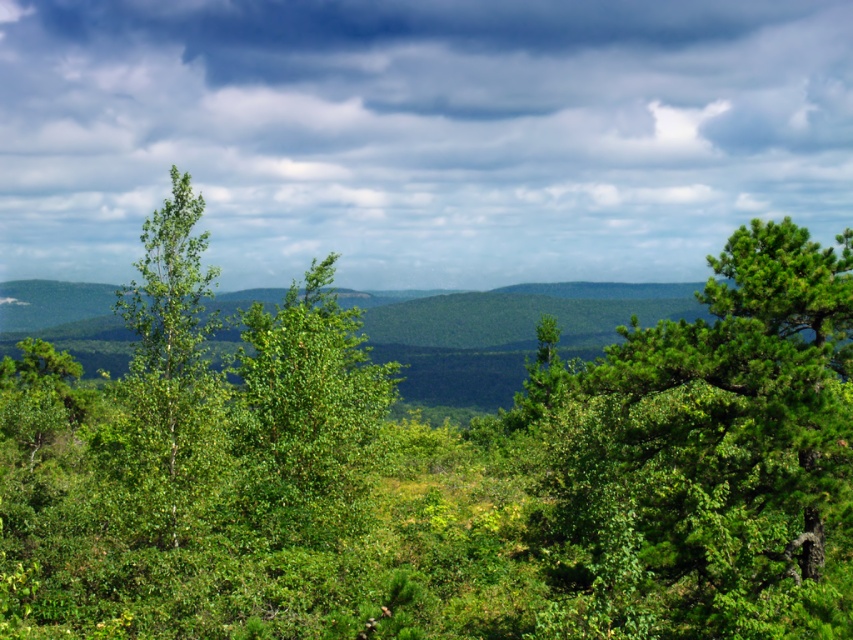
You are standing in the middle of the lush landscape and want to walk towards the green matte tree at right and the green matte tree at center. Which tree will you reach first if you walk straight ahead?

The green matte tree at right has a lesser width compared to the green matte tree at center, so it is closer to you. Therefore, you will reach the green matte tree at right first.